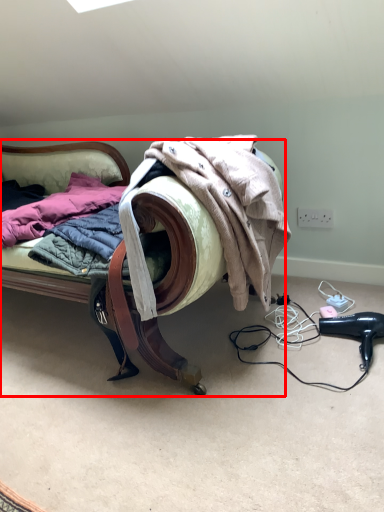
Question: Where is furniture (annotated by the red box) located in relation to hair drier in the image?

Choices:
 (A) left
 (B) right

Answer: (A)